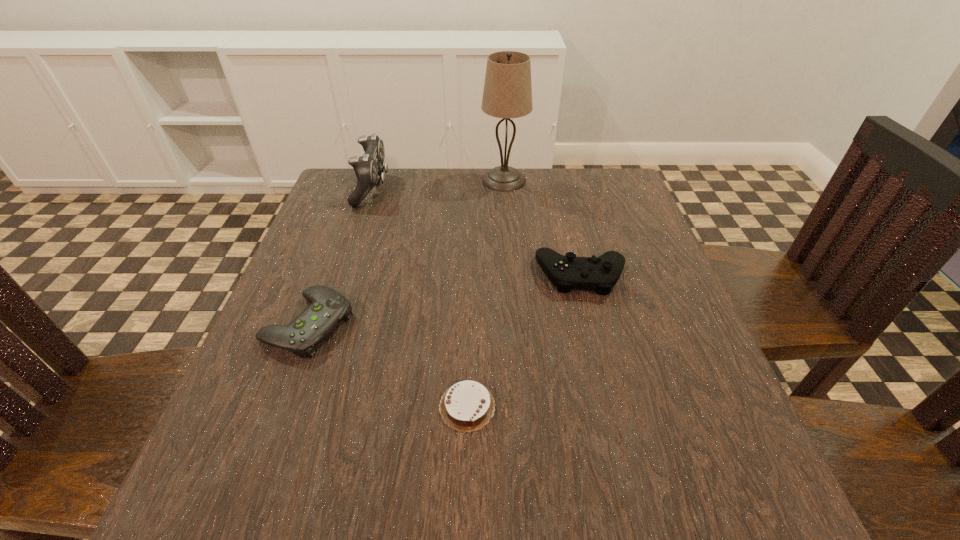
Identify the location of free space between the lampshade and the shortest control. (406, 252).

Image resolution: width=960 pixels, height=540 pixels. I want to click on empty space that is in between the third shortest object and the lampshade, so click(542, 228).

This screenshot has width=960, height=540. I want to click on free area in between the nearest object and the tallest object, so click(x=486, y=293).

Locate an element on the screen. This screenshot has height=540, width=960. free space that is in between the shortest control and the farthest control is located at coordinates (341, 256).

Find the location of `the closest object to the rightmost control`. the closest object to the rightmost control is located at coordinates (468, 406).

Identify which object is the third nearest to the fourth tallest object. Please provide its 2D coordinates. Your answer should be formatted as a tuple, i.e. [(x, y)], where the tuple contains the x and y coordinates of a point satisfying the conditions above.

[(600, 274)]

Locate an element on the screen. Image resolution: width=960 pixels, height=540 pixels. control that is the second closest to the fourth shortest object is located at coordinates click(x=600, y=274).

Identify which control is the second closest to the tallest object. Please provide its 2D coordinates. Your answer should be formatted as a tuple, i.e. [(x, y)], where the tuple contains the x and y coordinates of a point satisfying the conditions above.

[(600, 274)]

Where is `vacant space that satisfies the following two spatial constraints: 1. on the surface of the fourth shortest object with buttons; 2. on the front side of the second shortest object`? The height and width of the screenshot is (540, 960). vacant space that satisfies the following two spatial constraints: 1. on the surface of the fourth shortest object with buttons; 2. on the front side of the second shortest object is located at coordinates (328, 324).

Find the location of a particular element. free location that satisfies the following two spatial constraints: 1. on the back side of the chocolate cake; 2. on the right side of the rightmost control is located at coordinates (470, 275).